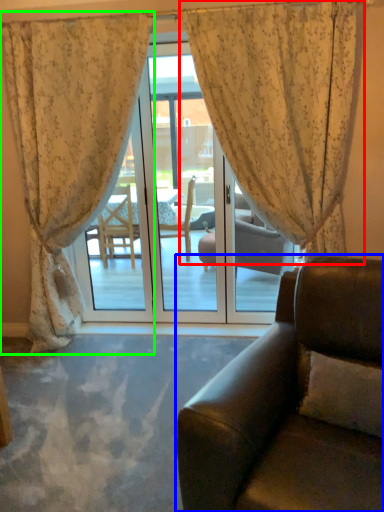
Question: Considering the real-world distances, which object is farthest from curtain (highlighted by a red box)? studio couch (highlighted by a blue box) or curtain (highlighted by a green box)?

Choices:
 (A) studio couch
 (B) curtain

Answer: (A)